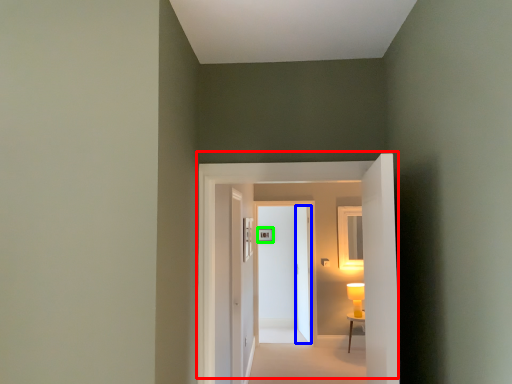
Question: Which object is the closest to the door (highlighted by a red box)? Choose among these: door (highlighted by a blue box) or picture frame (highlighted by a green box).

Choices:
 (A) door
 (B) picture frame

Answer: (A)